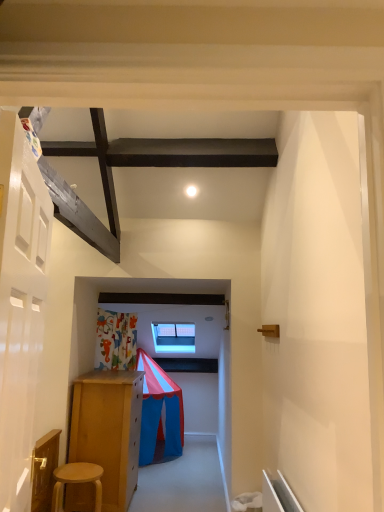
This screenshot has height=512, width=384. What are the coordinates of `free spot above light brown wooden stool at lower left (from a real-world perspective)` in the screenshot? It's located at (82, 473).